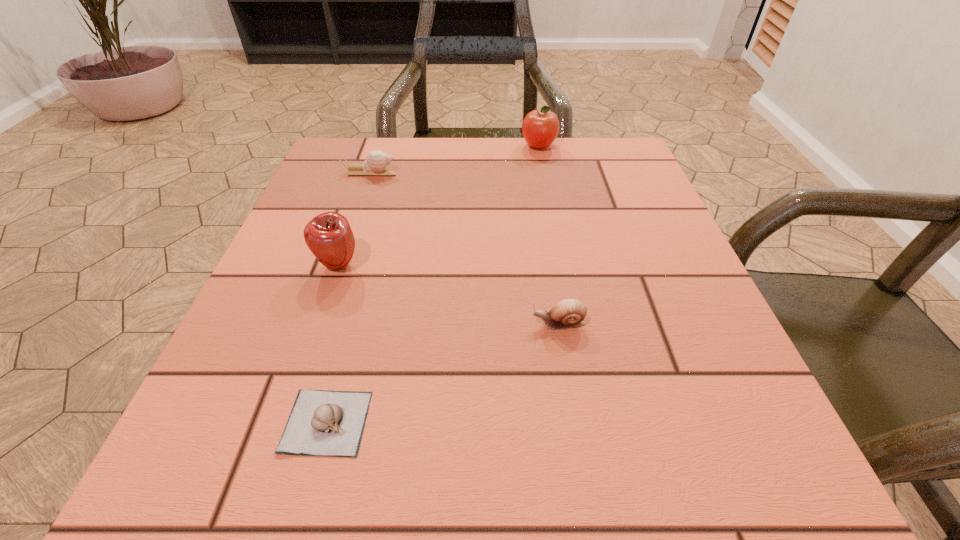
I want to click on the right apple, so click(540, 128).

The image size is (960, 540). I want to click on the farthest object, so click(540, 128).

The image size is (960, 540). Find the location of `the nearer apple`. the nearer apple is located at coordinates (329, 236).

This screenshot has width=960, height=540. In order to click on the third farthest object in this screenshot , I will do `click(329, 236)`.

Find the location of a particular element. Image resolution: width=960 pixels, height=540 pixels. the left escargot is located at coordinates (376, 162).

Locate an element on the screen. the second farthest object is located at coordinates (376, 162).

Locate an element on the screen. the right escargot is located at coordinates (569, 313).

The height and width of the screenshot is (540, 960). I want to click on the fourth farthest object, so click(x=569, y=313).

Locate an element on the screen. The image size is (960, 540). the nearest object is located at coordinates (328, 423).

You are a GUI agent. You are given a task and a screenshot of the screen. Output one action in this format:
    pyautogui.click(x=<x>, y=<y>)
    Task: Click on the shortest object
    The image size is (960, 540).
    Given the screenshot: What is the action you would take?
    pyautogui.click(x=328, y=423)